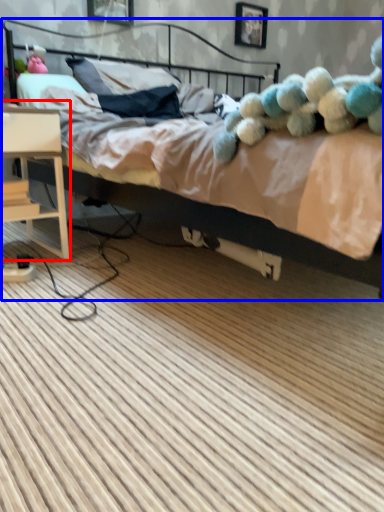
Question: Which of the following is the farthest to the observer, nightstand (highlighted by a red box) or bed (highlighted by a blue box)?

Choices:
 (A) nightstand
 (B) bed

Answer: (A)